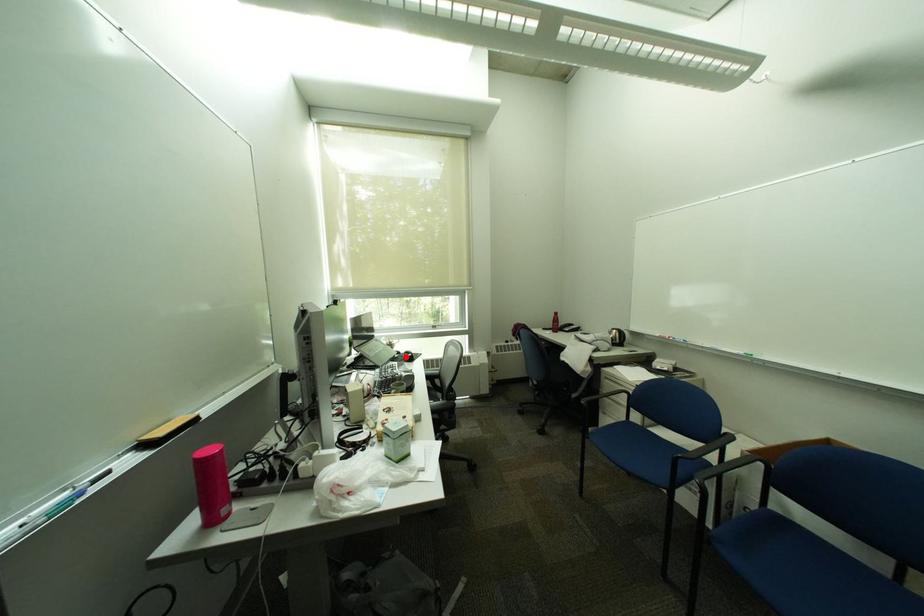
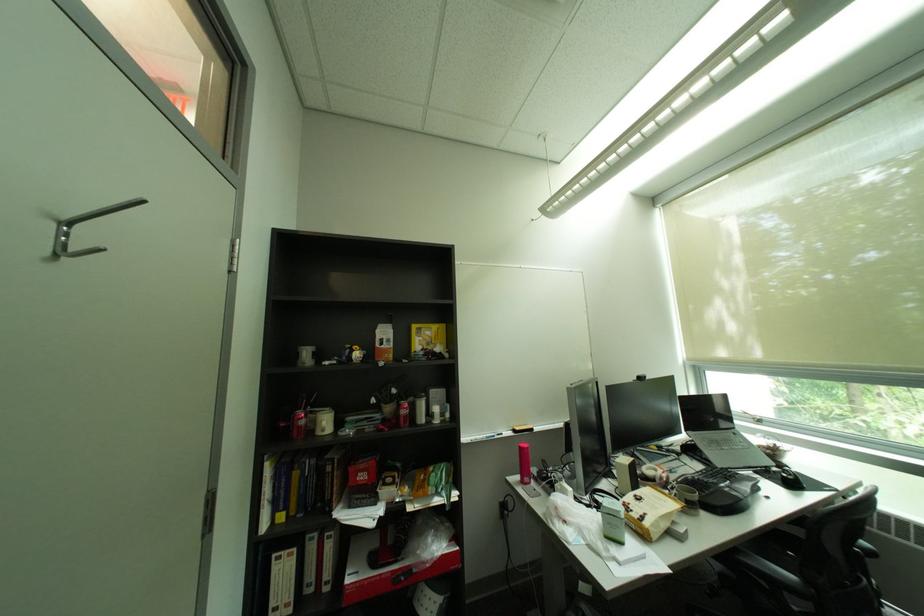
Where in the second image is the point corresponding to the highlighted location from the first image?

(777, 468)